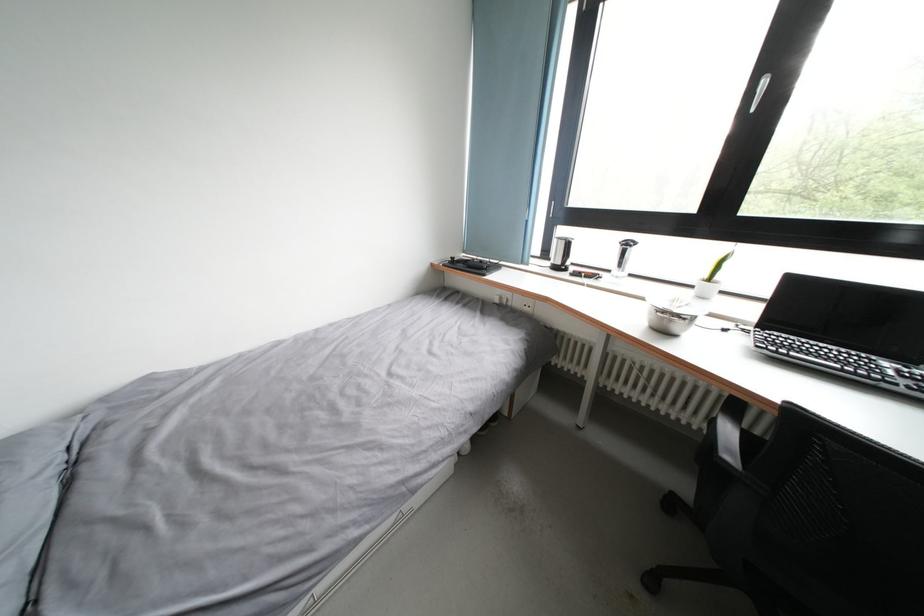
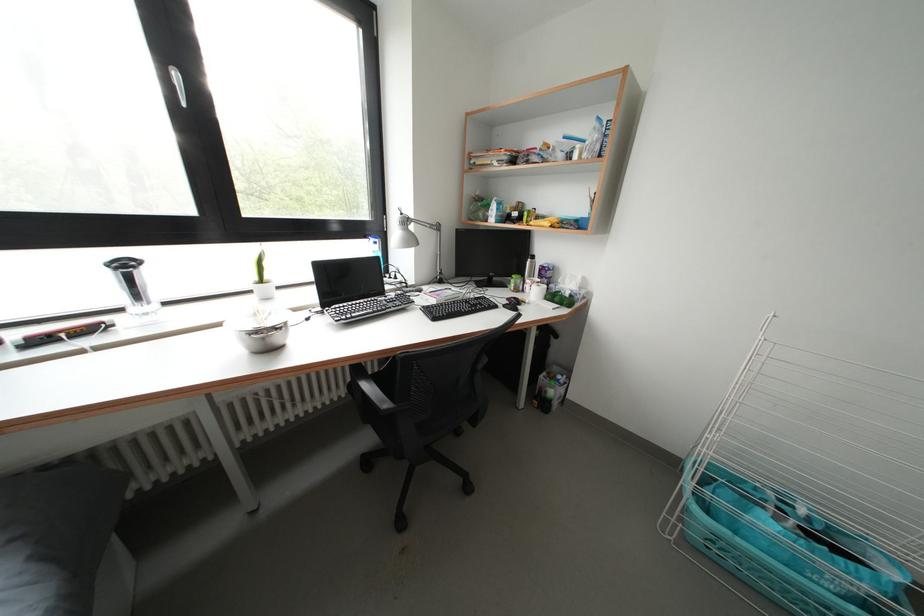
Find the pixel in the second image that matches (x=736, y=462) in the first image.

(392, 410)